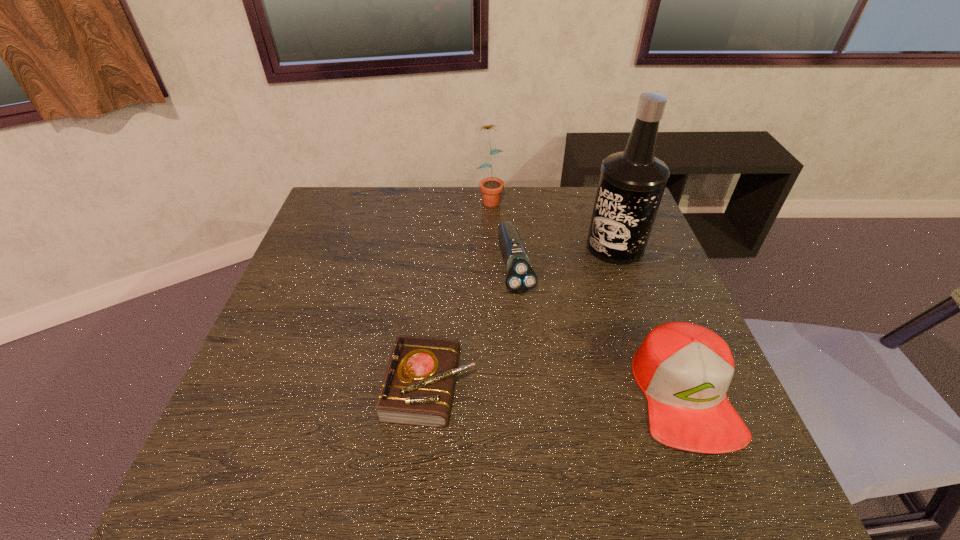
Locate an element on the screen. free space between the liquor and the third shortest object is located at coordinates (650, 321).

Locate an element on the screen. This screenshot has width=960, height=540. vacant space in between the sunflower and the diary is located at coordinates (461, 292).

Locate an element on the screen. The image size is (960, 540). free point between the second tallest object and the shortest object is located at coordinates (461, 292).

Where is `free space between the third shortest object and the tallest object`? This screenshot has height=540, width=960. free space between the third shortest object and the tallest object is located at coordinates (650, 321).

I want to click on vacant space in between the shortest object and the electric shaver, so click(474, 326).

The height and width of the screenshot is (540, 960). In order to click on vacant space that's between the third shortest object and the tallest object in this screenshot , I will do `click(650, 321)`.

The image size is (960, 540). I want to click on free space between the sunflower and the diary, so click(461, 292).

What are the coordinates of `empty space that is in between the third tallest object and the tallest object` in the screenshot? It's located at (650, 321).

Locate an element on the screen. This screenshot has height=540, width=960. vacant area that lies between the liquor and the electric shaver is located at coordinates (565, 256).

This screenshot has width=960, height=540. I want to click on object that is the third nearest to the baseball cap, so click(417, 389).